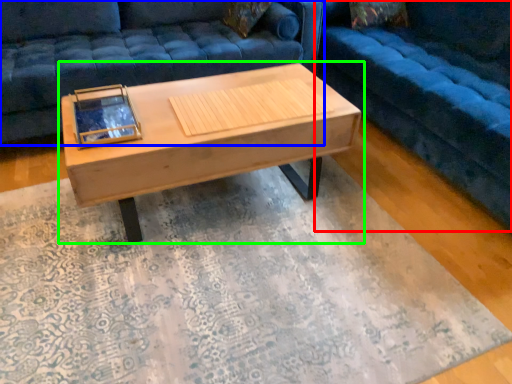
Question: Which object is positioned closest to studio couch (highlighted by a red box)? Select from studio couch (highlighted by a blue box) and coffee table (highlighted by a green box).

Choices:
 (A) studio couch
 (B) coffee table

Answer: (B)